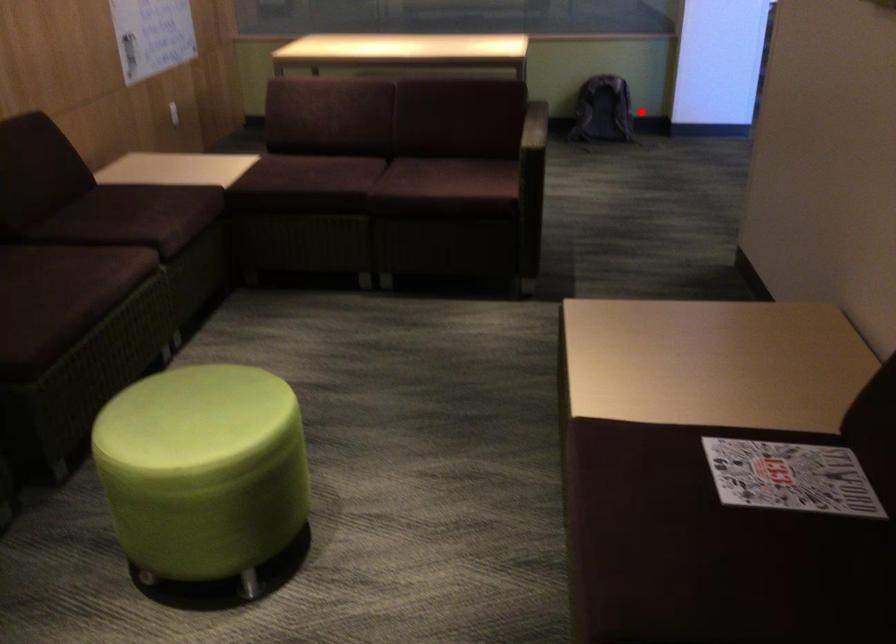
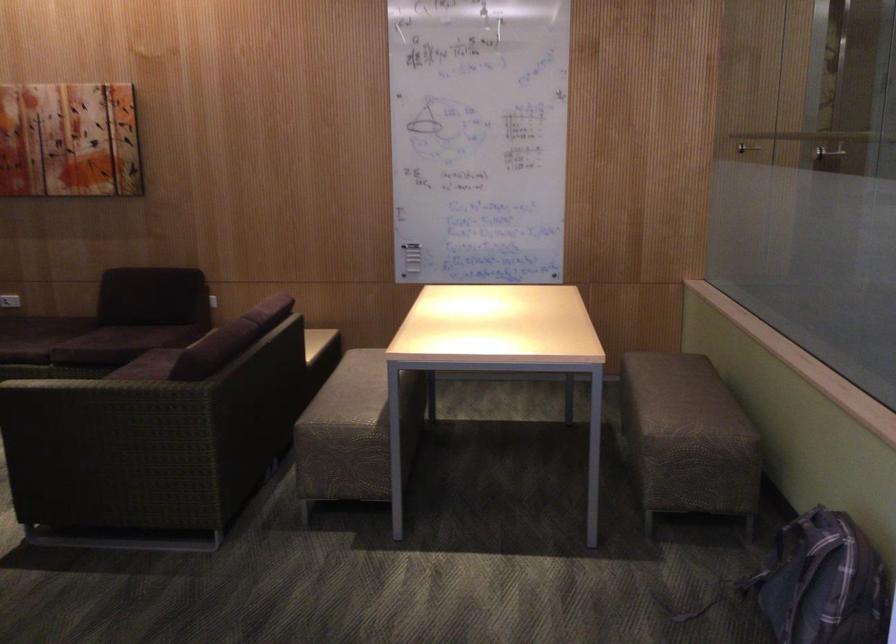
Find the pixel in the second image that matches the highlighted location in the first image.

(823, 583)